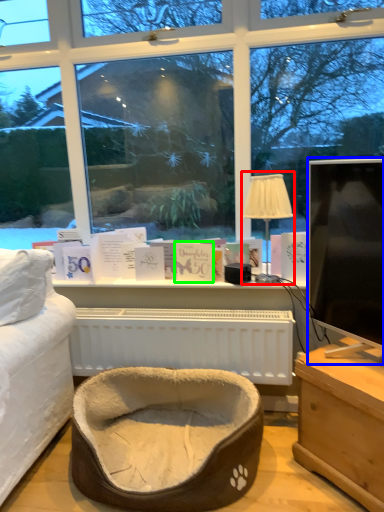
Question: Which object is positioned farthest from table lamp (highlighted by a red box)? Select from television (highlighted by a blue box) and book (highlighted by a green box).

Choices:
 (A) television
 (B) book

Answer: (B)